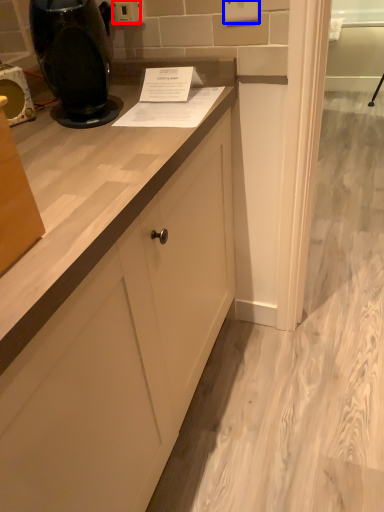
Question: Which object appears closest to the camera in this image, electric outlet (highlighted by a red box) or electric outlet (highlighted by a blue box)?

Choices:
 (A) electric outlet
 (B) electric outlet

Answer: (B)